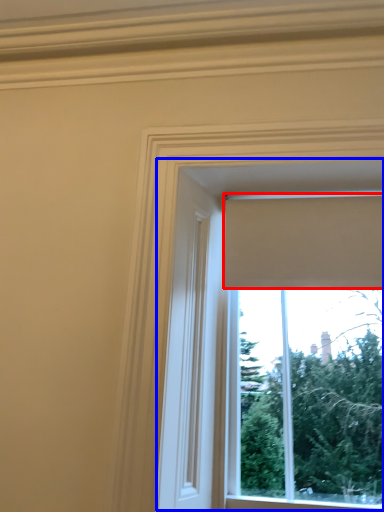
Question: Which of the following is the farthest to the observer, curtain (highlighted by a red box) or window (highlighted by a blue box)?

Choices:
 (A) curtain
 (B) window

Answer: (A)